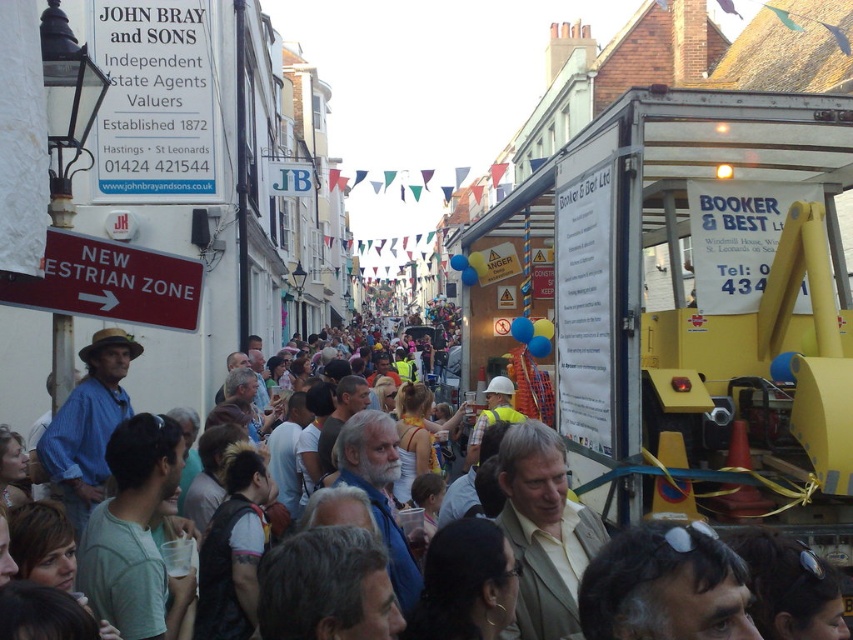
Question: Can you confirm if yellow plastic construction equipment at center is thinner than multicolored fabric crowd at center?

Choices:
 (A) yes
 (B) no

Answer: (A)

Question: Which point is closer to the camera taking this photo?

Choices:
 (A) (811, 253)
 (B) (531, 524)

Answer: (A)

Question: Which of the following is the farthest from the observer?

Choices:
 (A) (686, 448)
 (B) (614, 490)

Answer: (A)

Question: Is yellow plastic construction equipment at center thinner than multicolored fabric crowd at center?

Choices:
 (A) no
 (B) yes

Answer: (B)

Question: Is yellow plastic construction equipment at center bigger than multicolored fabric crowd at center?

Choices:
 (A) no
 (B) yes

Answer: (A)